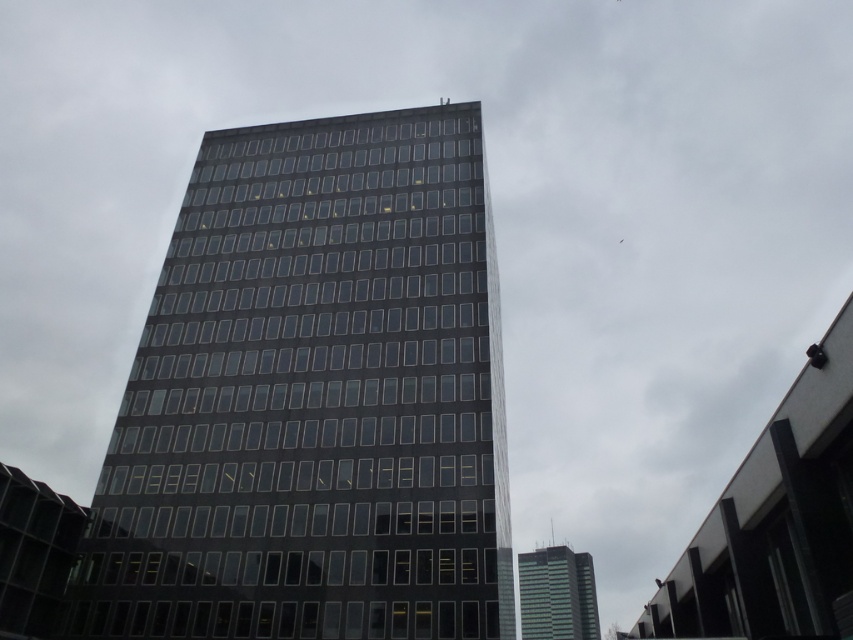
You are an architect evaluating two glass buildings in the city. The black glass building at center and the green glass building at center are both under consideration for a new project. Based on the image, which building would you recommend for a design that emphasizes vertical dominance? Explain your choice using the spatial details provided.

The black glass building at center is taller than the green glass building at center, making it the better choice for emphasizing vertical dominance in the design.

You are an architect evaluating the two glass buildings in the scene. Which building has a greater width between the black glass building at center and the green glass building at center?

The black glass building at center has a greater width than the green glass building at center as stated in the description.